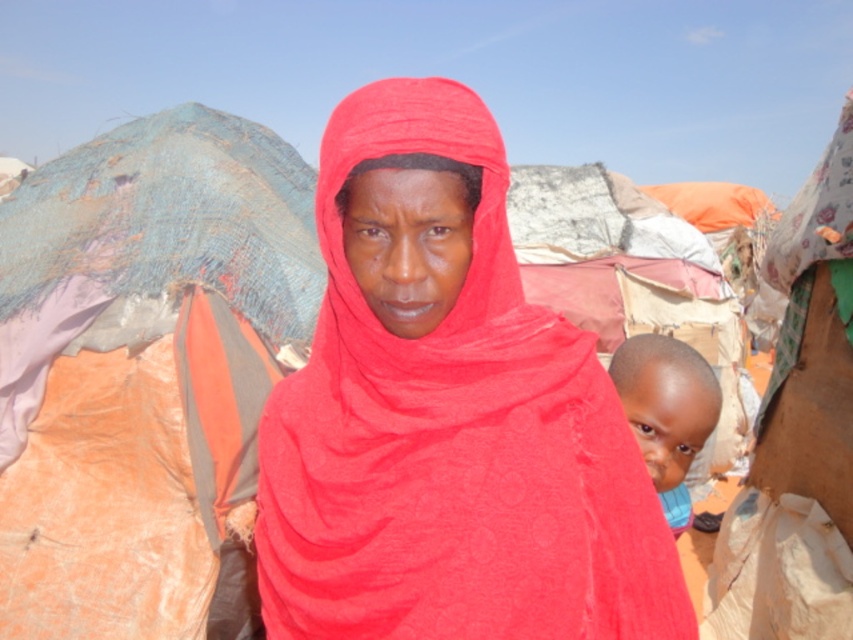
You are a photographer trying to capture a detailed shot of the two points in the image. The first point is labeled as point (393, 237) and the second is point (677, 460). Which point should you focus on first to ensure both are in sharp focus without having to adjust the camera focus afterward?

You should focus on point (393, 237) first because it is closer to the viewer than point (677, 460). By focusing on the closer point, the farther point will also be within the depth of field, ensuring both are in focus without needing to adjust the focus.

You are a photographer setting up a tripod to capture the woman in the scene. The matte red scarf at center and the blue fabric at right are both in your viewfinder. If you want to ensure both objects are in focus, what should you consider about their distance?

The matte red scarf at center is 19.88 inches from the blue fabric at right. To ensure both are in focus, you need to adjust the tripod to account for this distance between them.